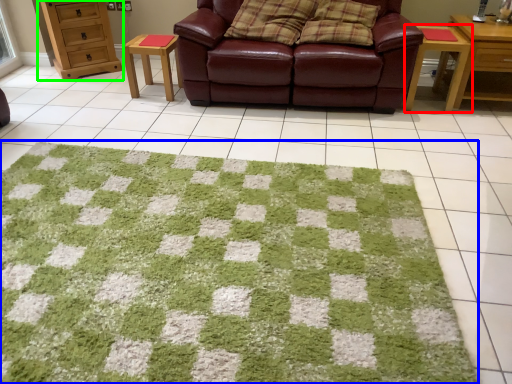
Question: Estimate the real-world distances between objects in this image. Which object is farther from table (highlighted by a red box), mat (highlighted by a blue box) or chest of drawers (highlighted by a green box)?

Choices:
 (A) mat
 (B) chest of drawers

Answer: (B)